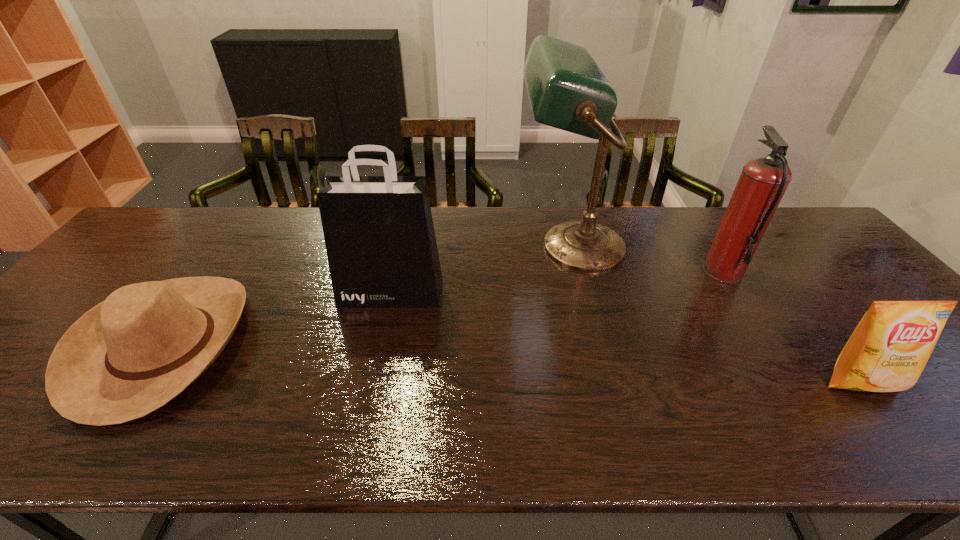
Locate an element on the screen. This screenshot has height=540, width=960. free space between the shopping bag and the table lamp is located at coordinates (481, 269).

At what (x,y) coordinates should I click in order to perform the action: click on empty space that is in between the fourth object from left to right and the cowboy hat. Please return your answer as a coordinate pair (x, y). The width and height of the screenshot is (960, 540). Looking at the image, I should click on (444, 308).

The image size is (960, 540). What are the coordinates of `empty space between the second object from right to left and the second object from left to right` in the screenshot? It's located at (557, 282).

You are a GUI agent. You are given a task and a screenshot of the screen. Output one action in this format:
    pyautogui.click(x=<x>, y=<y>)
    Task: Click on the vacant space in between the third object from left to right and the crisp (potato chip)
    This screenshot has height=540, width=960.
    Given the screenshot: What is the action you would take?
    pyautogui.click(x=716, y=314)

I want to click on vacant region between the leftmost object and the fourth object from right to left, so click(277, 319).

You are a GUI agent. You are given a task and a screenshot of the screen. Output one action in this format:
    pyautogui.click(x=<x>, y=<y>)
    Task: Click on the object that ranks as the second closest to the second object from right to left
    This screenshot has height=540, width=960.
    Given the screenshot: What is the action you would take?
    pyautogui.click(x=887, y=352)

Locate which object is the third closest to the crisp (potato chip). Please provide its 2D coordinates. Your answer should be formatted as a tuple, i.e. [(x, y)], where the tuple contains the x and y coordinates of a point satisfying the conditions above.

[(379, 235)]

Locate an element on the screen. Image resolution: width=960 pixels, height=540 pixels. vacant area that satisfies the following two spatial constraints: 1. at the nozzle of the fourth object from left to right; 2. on the front with handles of the second object from left to right is located at coordinates (735, 293).